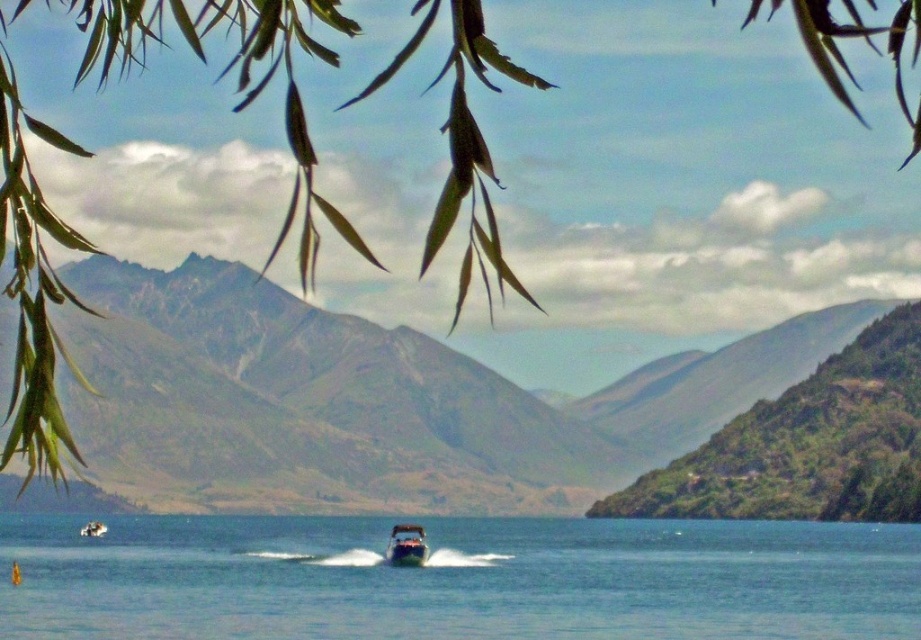
The height and width of the screenshot is (640, 921). Describe the element at coordinates (458, 579) in the screenshot. I see `clear blue water at center` at that location.

Can you confirm if clear blue water at center is positioned below shiny metallic boat at center?

Yes.

What are the coordinates of `clear blue water at center` in the screenshot? It's located at (458, 579).

Is shiny metallic boat at center smaller than metallic silver boat at center?

Incorrect, shiny metallic boat at center is not smaller in size than metallic silver boat at center.

Find the location of a particular element. The width and height of the screenshot is (921, 640). shiny metallic boat at center is located at coordinates click(406, 545).

Is clear blue water at center taller than metallic silver boat at center?

Indeed, clear blue water at center has a greater height compared to metallic silver boat at center.

Does clear blue water at center appear on the right side of metallic silver boat at center?

Yes, clear blue water at center is to the right of metallic silver boat at center.

Identify the location of clear blue water at center. This screenshot has height=640, width=921. (x=458, y=579).

The width and height of the screenshot is (921, 640). I want to click on clear blue water at center, so click(x=458, y=579).